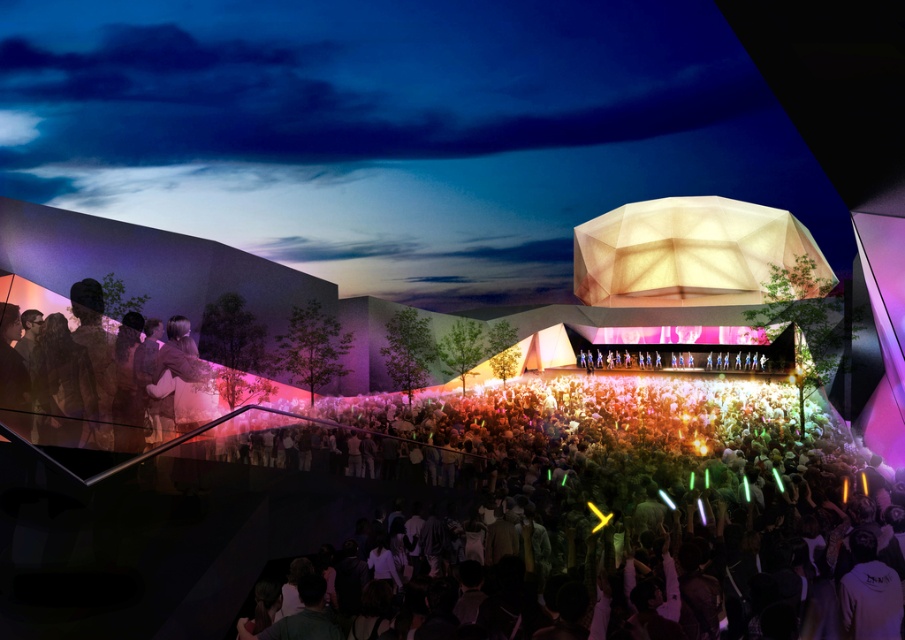
Between multicolored glow sticks at center and silhouette fabric at left, which one has less height?

With less height is multicolored glow sticks at center.

The height and width of the screenshot is (640, 905). What do you see at coordinates (640, 506) in the screenshot?
I see `multicolored glow sticks at center` at bounding box center [640, 506].

Who is more distant from viewer, (861, 481) or (110, 388)?

Point (110, 388)

The image size is (905, 640). I want to click on multicolored glow sticks at center, so click(x=640, y=506).